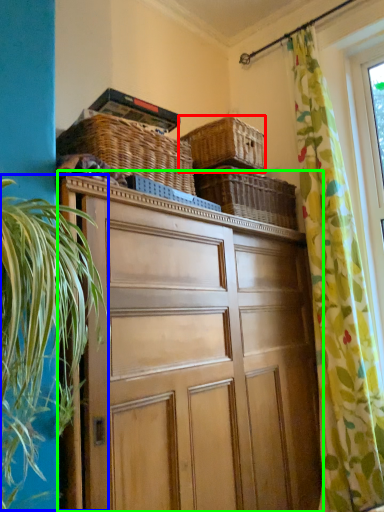
Question: Considering the real-world distances, which object is farthest from basket (highlighted by a red box)? vegetation (highlighted by a blue box) or cabinetry (highlighted by a green box)?

Choices:
 (A) vegetation
 (B) cabinetry

Answer: (A)